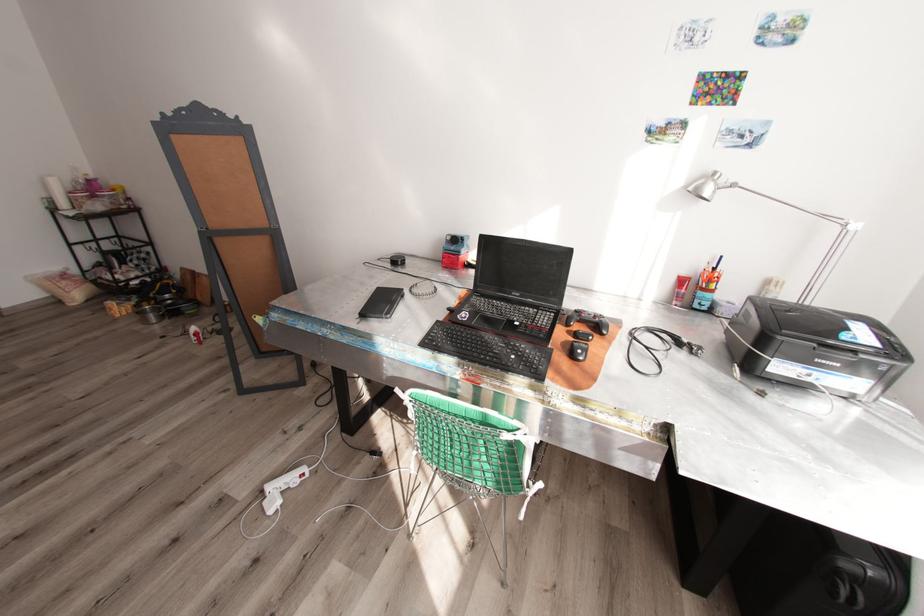
The width and height of the screenshot is (924, 616). What do you see at coordinates (523, 269) in the screenshot?
I see `a laptop lid` at bounding box center [523, 269].